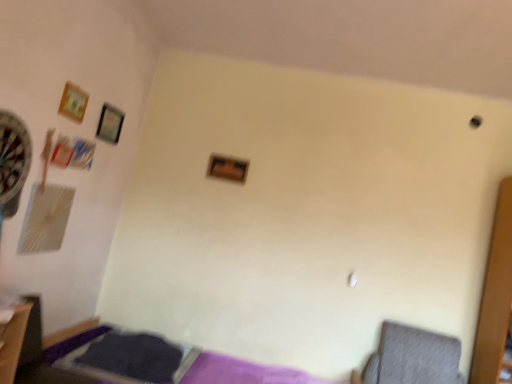
Question: Would you say gray fabric swivel chair at lower right is inside or outside wooden frame at upper left, the first picture frame positioned from the left?

Choices:
 (A) inside
 (B) outside

Answer: (B)

Question: From the image's perspective, relative to wooden frame at upper left, acting as the 3th picture frame starting from the right, is gray fabric swivel chair at lower right above or below?

Choices:
 (A) below
 (B) above

Answer: (A)

Question: Which is farther from the wooden frame at center, marked as the 1th picture frame in a right-to-left arrangement?

Choices:
 (A) matte black picture frame at upper left, positioned as the second picture frame in left-to-right order
 (B) metallic silver dartboard at left
 (C) purple fabric bed at lower left
 (D) wooden frame at upper left, the 3th picture frame in the back-to-front sequence
 (E) gray fabric swivel chair at lower right

Answer: (E)

Question: Which is nearer to the wooden frame at center, the first picture frame when ordered from back to front?

Choices:
 (A) matte black picture frame at upper left, positioned as the second picture frame in left-to-right order
 (B) gray fabric swivel chair at lower right
 (C) metallic silver dartboard at left
 (D) purple fabric bed at lower left
 (E) wooden frame at upper left, the 3th picture frame in the back-to-front sequence

Answer: (A)